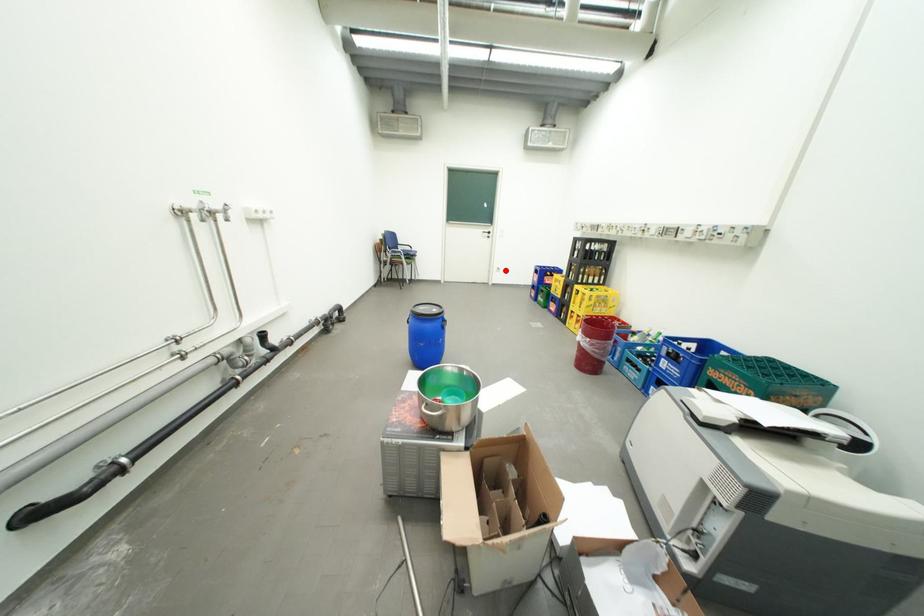
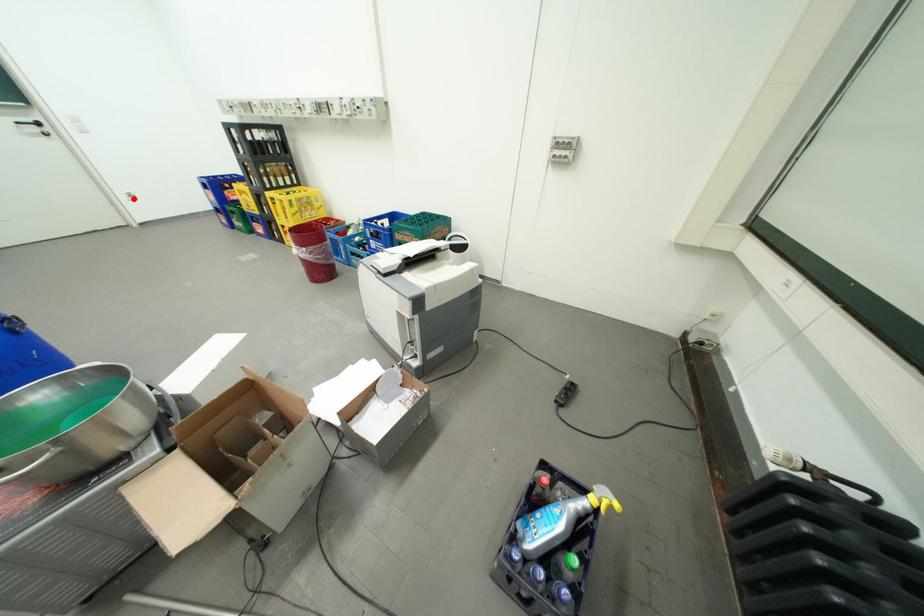
I am providing you with two images of the same scene from different viewpoints. A red point is marked on the first image and another point is marked on the second image. Is the marked point in image1 the same physical position as the marked point in image2?

Yes